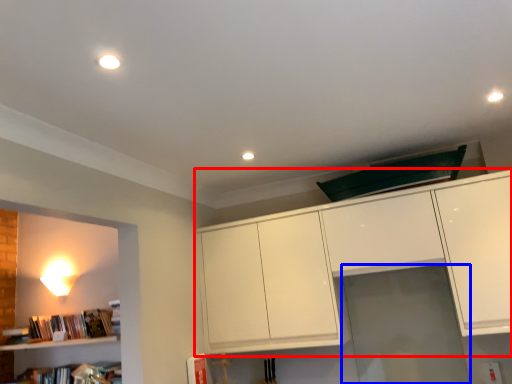
Question: Which of the following is the farthest to the observer, cabinetry (highlighted by a red box) or glass door (highlighted by a blue box)?

Choices:
 (A) cabinetry
 (B) glass door

Answer: (B)